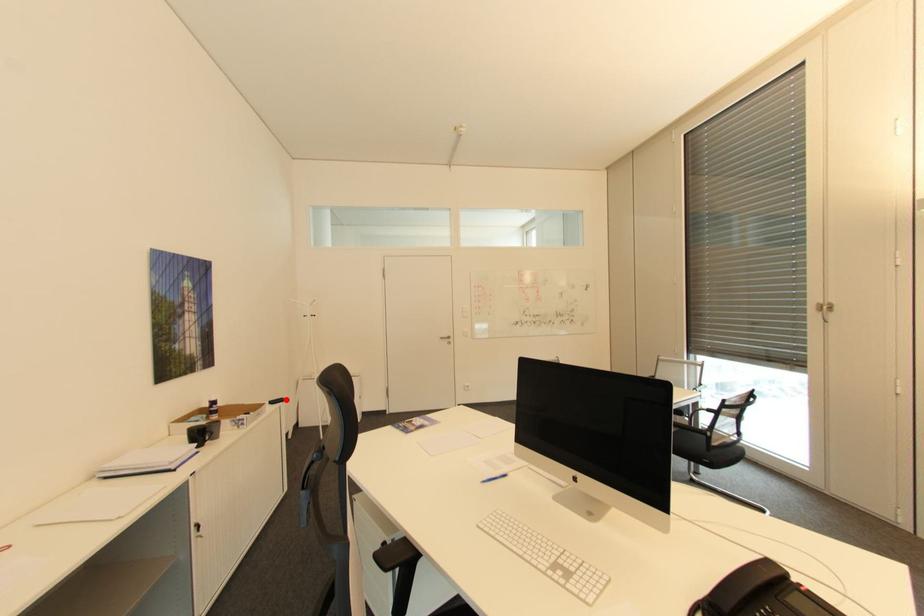
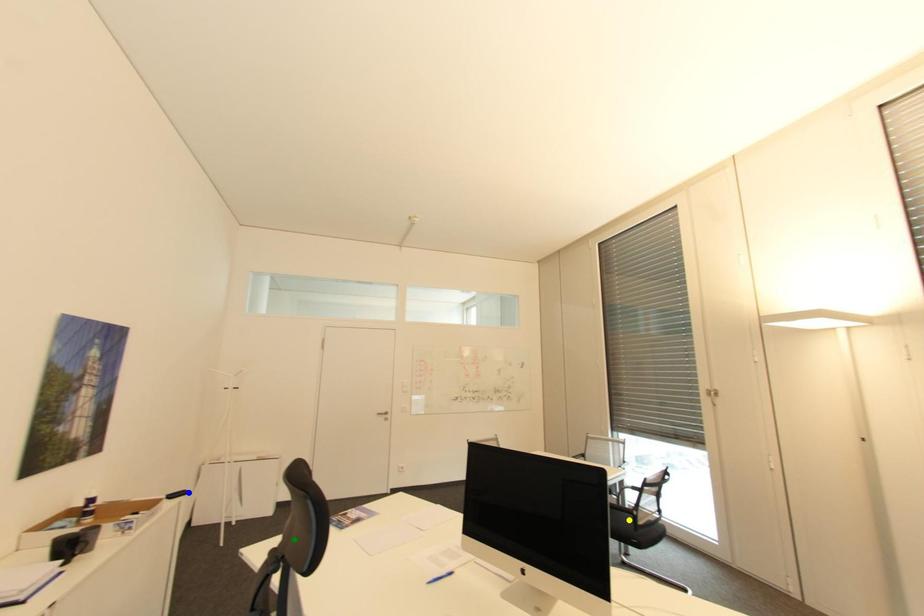
Question: I am providing you with two images of the same scene from different viewpoints. A red point is marked on the first image. You are given multiple points on the second image. Which mark in image 2 goes with the point in image 1?

Choices:
 (A) yellow point
 (B) blue point
 (C) green point

Answer: (B)